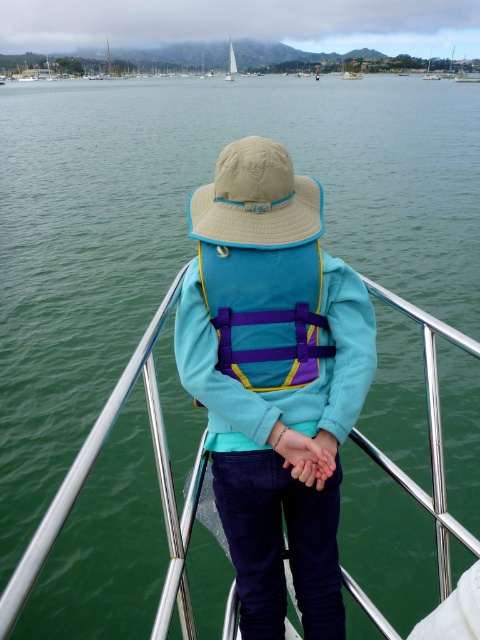
Is point (261, 314) farther from camera compared to point (235, 67)?

That is False.

Who is positioned more to the left, matte blue life jacket at center or white sailboat at center?

white sailboat at center

Between point (252, 305) and point (235, 70), which one is positioned in front?

Point (252, 305)

This screenshot has height=640, width=480. Find the location of `matte blue life jacket at center`. matte blue life jacket at center is located at coordinates (265, 312).

Does point (479, 60) come in front of point (359, 74)?

No, (479, 60) is behind (359, 74).

Between white plastic boat at center and white glossy sailboat at center, which one is positioned lower?

white glossy sailboat at center is lower down.

This screenshot has height=640, width=480. In order to click on white plastic boat at center in this screenshot , I will do `click(468, 70)`.

Between point (295, 285) and point (469, 81), which one is positioned in front?

Point (295, 285) is more forward.

Looking at this image, can you confirm if matte blue life jacket at center is thinner than white plastic boat at center?

Yes, matte blue life jacket at center is thinner than white plastic boat at center.

I want to click on matte blue life jacket at center, so click(x=265, y=312).